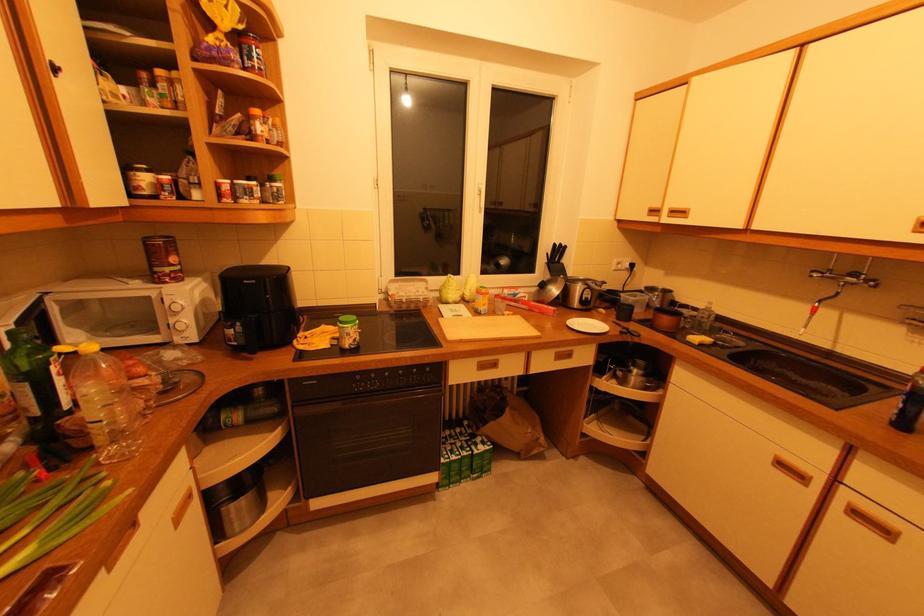
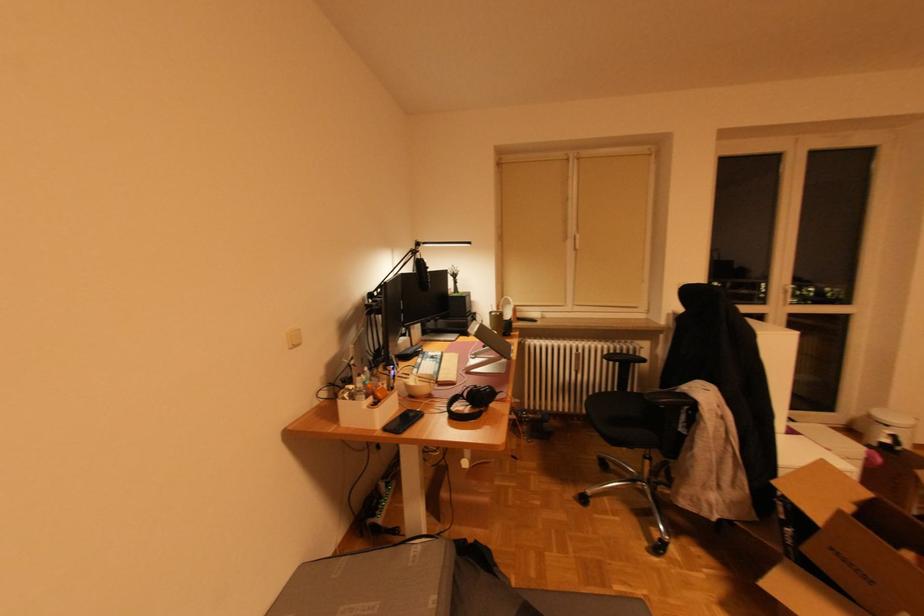
Question: The images are taken continuously from a first-person perspective. In which direction are you moving?

Choices:
 (A) Left
 (B) Right
 (C) Forward
 (D) Backward

Answer: (B)